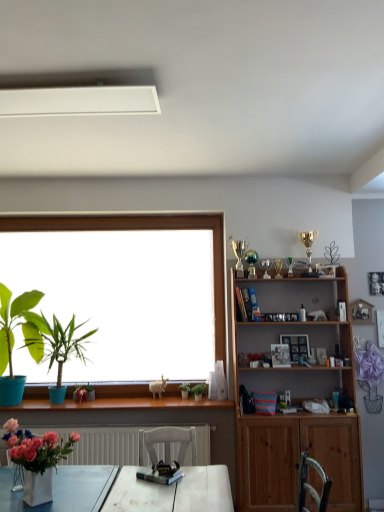
Question: From a real-world perspective, is wooden shelf at right on matte blue pot at left, which is the third houseplant in right-to-left order?

Choices:
 (A) yes
 (B) no

Answer: (B)

Question: Is wooden shelf at right shorter than matte blue pot at left, which is the third houseplant in right-to-left order?

Choices:
 (A) no
 (B) yes

Answer: (A)

Question: Is wooden shelf at right far from matte blue pot at left, which is the third houseplant in right-to-left order?

Choices:
 (A) no
 (B) yes

Answer: (B)

Question: Is wooden shelf at right directly adjacent to matte blue pot at left, which is the third houseplant in right-to-left order?

Choices:
 (A) yes
 (B) no

Answer: (B)

Question: From the image's perspective, is wooden shelf at right below matte blue pot at left, which is the third houseplant in right-to-left order?

Choices:
 (A) no
 (B) yes

Answer: (B)

Question: Based on their positions, is white matte exhaust hood at upper center located to the left or right of wooden shelf at right?

Choices:
 (A) left
 (B) right

Answer: (A)

Question: Considering the positions of white matte exhaust hood at upper center and wooden shelf at right in the image, is white matte exhaust hood at upper center bigger or smaller than wooden shelf at right?

Choices:
 (A) big
 (B) small

Answer: (B)

Question: Considering the positions of white matte exhaust hood at upper center and wooden shelf at right in the image, is white matte exhaust hood at upper center taller or shorter than wooden shelf at right?

Choices:
 (A) tall
 (B) short

Answer: (B)

Question: Is white matte exhaust hood at upper center in front of or behind wooden shelf at right in the image?

Choices:
 (A) front
 (B) behind

Answer: (A)

Question: From the image's perspective, relative to green matte plant at center, marked as the first houseplant in a right-to-left arrangement, is white matte exhaust hood at upper center above or below?

Choices:
 (A) above
 (B) below

Answer: (A)

Question: Considering their positions, is white matte exhaust hood at upper center located in front of or behind green matte plant at center, marked as the first houseplant in a right-to-left arrangement?

Choices:
 (A) front
 (B) behind

Answer: (A)

Question: Is white matte exhaust hood at upper center wider or thinner than green matte plant at center, arranged as the 4th houseplant when viewed from the left?

Choices:
 (A) wide
 (B) thin

Answer: (A)

Question: From a real-world perspective, is white matte exhaust hood at upper center above or below green matte plant at center, arranged as the 4th houseplant when viewed from the left?

Choices:
 (A) above
 (B) below

Answer: (A)

Question: In terms of width, does green matte plant at center, marked as the first houseplant in a right-to-left arrangement, look wider or thinner when compared to matte green plant at left, the first houseplant from the left?

Choices:
 (A) wide
 (B) thin

Answer: (B)

Question: Considering the relative positions of green matte plant at center, marked as the first houseplant in a right-to-left arrangement, and matte green plant at left, the first houseplant from the left, in the image provided, is green matte plant at center, marked as the first houseplant in a right-to-left arrangement, to the left or to the right of matte green plant at left, the first houseplant from the left,?

Choices:
 (A) left
 (B) right

Answer: (B)